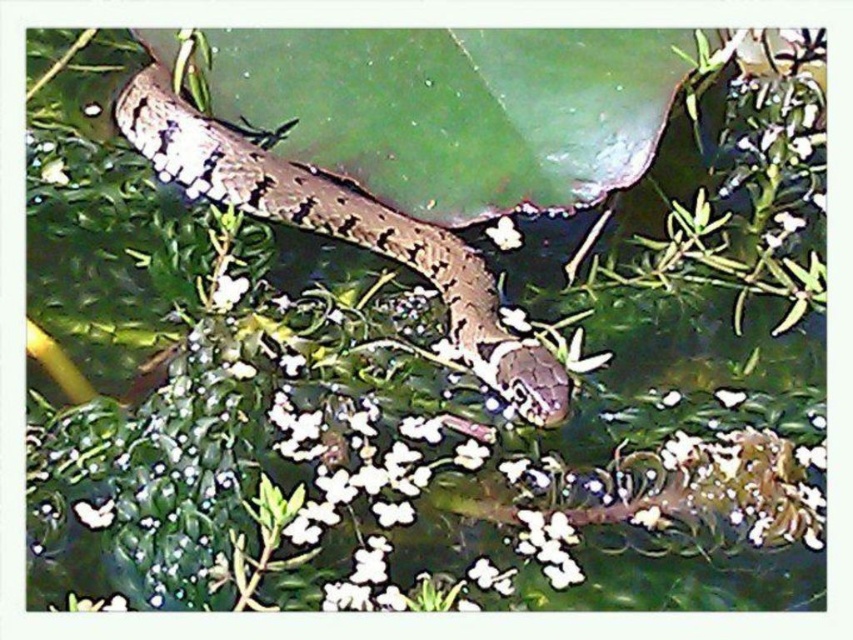
You are a frog sitting on the white matte flower at upper center and want to jump to the nearest leaf. There is a speckled brown snake at center between you and the leaf. Is the snake blocking your path?

The speckled brown snake at center is to the left of the white matte flower at upper center, so the snake is not directly in your path. You can jump around it to reach the leaf.

You are a small insect floating on the water. You see two white matte flowers in the scene. How far apart are the white matte flower at center and the white matte flower at upper center?

The white matte flower at center is 48.59 centimeters from the white matte flower at upper center.